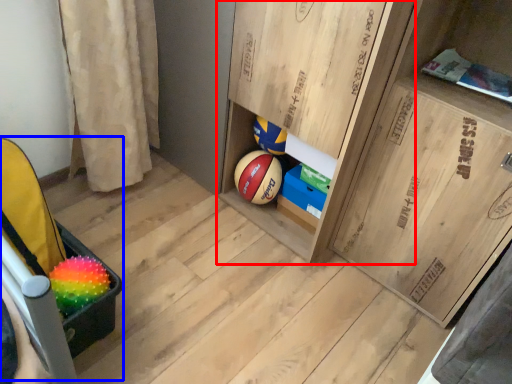
Question: Which object appears farthest to the camera in this image, cabinetry (highlighted by a red box) or baby carriage (highlighted by a blue box)?

Choices:
 (A) cabinetry
 (B) baby carriage

Answer: (B)